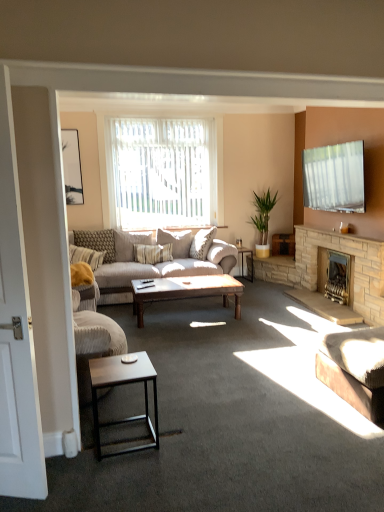
Describe the element at coordinates (97, 242) in the screenshot. I see `textured beige pillow at center, which appears as the second pillow when viewed from the right` at that location.

You are a GUI agent. You are given a task and a screenshot of the screen. Output one action in this format:
    pyautogui.click(x=<x>, y=<y>)
    Task: Click on the brown textured fabric studio couch at lower right, which is the 2th studio couch in back-to-front order
    This screenshot has height=512, width=384.
    Given the screenshot: What is the action you would take?
    pyautogui.click(x=354, y=370)

Find the location of a particular element. black wood side table at center is located at coordinates (242, 262).

Where is `green leafy plant at center-right`? Image resolution: width=384 pixels, height=512 pixels. green leafy plant at center-right is located at coordinates (263, 214).

Identify the location of picture frame lying behind the wooden coffee table at center, marked as the 1th coffee table in a back-to-front arrangement. Image resolution: width=384 pixels, height=512 pixels. (72, 167).

Based on the photo, considering the relative positions of matte black picture frame at upper left and wooden coffee table at center, acting as the 2th coffee table starting from the front, in the image provided, is matte black picture frame at upper left to the left or to the right of wooden coffee table at center, acting as the 2th coffee table starting from the front,?

Based on their positions, matte black picture frame at upper left is located to the left of wooden coffee table at center, acting as the 2th coffee table starting from the front.

Is matte black picture frame at upper left oriented away from wooden coffee table at center, marked as the 1th coffee table in a back-to-front arrangement?

matte black picture frame at upper left does not have its back to wooden coffee table at center, marked as the 1th coffee table in a back-to-front arrangement.

Measure the distance from matte black picture frame at upper left to wooden coffee table at center, marked as the 1th coffee table in a back-to-front arrangement.

They are 2.06 meters apart.

Is the surface of beige fabric couch at center, which ranks as the 2th studio couch in right-to-left order, in direct contact with brown textured fabric studio couch at lower right, which is the 2th studio couch in back-to-front order?

beige fabric couch at center, which ranks as the 2th studio couch in right-to-left order, and brown textured fabric studio couch at lower right, which is the 2th studio couch in back-to-front order, are clearly separated.

Is beige fabric couch at center, which ranks as the first studio couch in back-to-front order, situated inside brown textured fabric studio couch at lower right, marked as the first studio couch in a right-to-left arrangement, or outside?

beige fabric couch at center, which ranks as the first studio couch in back-to-front order, is not enclosed by brown textured fabric studio couch at lower right, marked as the first studio couch in a right-to-left arrangement.

Considering the sizes of beige fabric couch at center, the 2th studio couch positioned from the front, and brown textured fabric studio couch at lower right, the 2th studio couch positioned from the left, in the image, is beige fabric couch at center, the 2th studio couch positioned from the front, wider or thinner than brown textured fabric studio couch at lower right, the 2th studio couch positioned from the left,?

Clearly, beige fabric couch at center, the 2th studio couch positioned from the front, has more width compared to brown textured fabric studio couch at lower right, the 2th studio couch positioned from the left.

Does point (225, 273) come farther from viewer compared to point (363, 375)?

That is True.

Is white wood screen door at left at the back of beige fabric pillow at center, the 1th pillow in the right-to-left sequence?

beige fabric pillow at center, the 1th pillow in the right-to-left sequence, is not turned away from white wood screen door at left.

Who is taller, beige fabric pillow at center, marked as the 3th pillow in a left-to-right arrangement, or white wood screen door at left?

white wood screen door at left.

From the image's perspective, which object appears higher, beige fabric pillow at center, the 1th pillow in the right-to-left sequence, or white wood screen door at left?

beige fabric pillow at center, the 1th pillow in the right-to-left sequence.

Looking at their sizes, would you say beige fabric pillow at center, the 1th pillow in the right-to-left sequence, is wider or thinner than white wood screen door at left?

In the image, beige fabric pillow at center, the 1th pillow in the right-to-left sequence, appears to be wider than white wood screen door at left.

Could you measure the distance between stone fireplace at right, the 2th fireplace when ordered from back to front, and textured beige pillow at left, the 3th pillow in the right-to-left sequence?

stone fireplace at right, the 2th fireplace when ordered from back to front, and textured beige pillow at left, the 3th pillow in the right-to-left sequence, are 2.82 meters apart from each other.

Does point (373, 302) come farther from viewer compared to point (73, 259)?

No, it is not.

How many degrees apart are the facing directions of stone fireplace at right, the 1th fireplace from the front, and textured beige pillow at left, the first pillow from the left?

73.3 degrees.

Is stone fireplace at right, the 1th fireplace from the front, next to textured beige pillow at left, the 3th pillow in the right-to-left sequence?

stone fireplace at right, the 1th fireplace from the front, is not next to textured beige pillow at left, the 3th pillow in the right-to-left sequence, and they're not touching.

Is beige fabric pillow at center, marked as the 3th pillow in a left-to-right arrangement, touching black wood side table at center?

No, beige fabric pillow at center, marked as the 3th pillow in a left-to-right arrangement, is not in contact with black wood side table at center.

Which object is wider, beige fabric pillow at center, marked as the 3th pillow in a left-to-right arrangement, or black wood side table at center?

black wood side table at center.

Is point (123, 236) in front of point (252, 263)?

That is True.

Is beige fabric pillow at center, the 1th pillow in the right-to-left sequence, facing towards black wood side table at center?

No, beige fabric pillow at center, the 1th pillow in the right-to-left sequence, is not turned towards black wood side table at center.

Considering the sizes of objects beige fabric pillow at center, marked as the 3th pillow in a left-to-right arrangement, and brown textured fabric studio couch at lower right, the first studio couch from the front, in the image provided, who is thinner, beige fabric pillow at center, marked as the 3th pillow in a left-to-right arrangement, or brown textured fabric studio couch at lower right, the first studio couch from the front,?

With smaller width is beige fabric pillow at center, marked as the 3th pillow in a left-to-right arrangement.

In the scene shown: How many degrees apart are the facing directions of beige fabric pillow at center, marked as the 3th pillow in a left-to-right arrangement, and brown textured fabric studio couch at lower right, which is the 2th studio couch in back-to-front order?

beige fabric pillow at center, marked as the 3th pillow in a left-to-right arrangement, and brown textured fabric studio couch at lower right, which is the 2th studio couch in back-to-front order, are facing 93.7 degrees away from each other.

In the image, is beige fabric pillow at center, marked as the 3th pillow in a left-to-right arrangement, positioned in front of or behind brown textured fabric studio couch at lower right, marked as the first studio couch in a right-to-left arrangement?

beige fabric pillow at center, marked as the 3th pillow in a left-to-right arrangement, is positioned farther from the viewer than brown textured fabric studio couch at lower right, marked as the first studio couch in a right-to-left arrangement.

From the picture: Considering the relative sizes of beige fabric pillow at center, the 1th pillow in the right-to-left sequence, and brown textured fabric studio couch at lower right, the first studio couch from the front, in the image provided, is beige fabric pillow at center, the 1th pillow in the right-to-left sequence, taller than brown textured fabric studio couch at lower right, the first studio couch from the front,?

Correct, beige fabric pillow at center, the 1th pillow in the right-to-left sequence, is much taller as brown textured fabric studio couch at lower right, the first studio couch from the front.

Who is taller, wooden coffee table at center, acting as the 2th coffee table starting from the front, or matte black picture frame at upper left?

matte black picture frame at upper left.

Is wooden coffee table at center, acting as the 2th coffee table starting from the front, positioned with its back to matte black picture frame at upper left?

No, wooden coffee table at center, acting as the 2th coffee table starting from the front,'s orientation is not away from matte black picture frame at upper left.

This screenshot has height=512, width=384. There is a matte black picture frame at upper left. Find the location of `the 1st coffee table below it (from the image's perspective)`. the 1st coffee table below it (from the image's perspective) is located at coordinates (186, 291).

This screenshot has width=384, height=512. Identify the location of picture frame on the left of wooden coffee table at center, acting as the 2th coffee table starting from the front. (72, 167).

You are a GUI agent. You are given a task and a screenshot of the screen. Output one action in this format:
    pyautogui.click(x=<x>, y=<y>)
    Task: Click on the studio couch that is under the beige fabric couch at center, the 2th studio couch positioned from the front (from a real-world perspective)
    This screenshot has height=512, width=384.
    Given the screenshot: What is the action you would take?
    pyautogui.click(x=354, y=370)

From the picture: Based on their spatial positions, is textured beige pillow at left, the 3th pillow in the right-to-left sequence, or textured beige pillow at center, which appears as the second pillow when viewed from the right, further from wooden coffee table at center, acting as the 2th coffee table starting from the front?

textured beige pillow at center, which appears as the second pillow when viewed from the right, is positioned further to the anchor wooden coffee table at center, acting as the 2th coffee table starting from the front.

Estimate the real-world distances between objects in this image. Which object is further from dark brown wooden coffee table at center, the first coffee table positioned from the front, wooden coffee table at center, acting as the 2th coffee table starting from the front, or green leafy plant at center-right?

green leafy plant at center-right is positioned further to the anchor dark brown wooden coffee table at center, the first coffee table positioned from the front.

Estimate the real-world distances between objects in this image. Which object is further from black wood side table at center, textured beige pillow at center, which appears as the second pillow when viewed from the right, or dark brown wooden coffee table at center, the first coffee table positioned from the front?

Among the two, dark brown wooden coffee table at center, the first coffee table positioned from the front, is located further to black wood side table at center.

From the image, which object appears to be nearer to textured beige pillow at center, the 2th pillow viewed from the left, beige fabric couch at center, which ranks as the first studio couch in back-to-front order, or stone fireplace at right, the 1th fireplace from the front?

The object closer to textured beige pillow at center, the 2th pillow viewed from the left, is beige fabric couch at center, which ranks as the first studio couch in back-to-front order.

Considering their positions, is black wood side table at center positioned closer to green leafy plant at center-right than dark brown wooden coffee table at center, the first coffee table positioned from the front?

black wood side table at center lies closer to green leafy plant at center-right than the other object.

Looking at the image, which one is located closer to white sheer curtains at center, brass/bronze fireplace at lower right, placed as the second fireplace when sorted from front to back, or stone fireplace at right, the 1th fireplace from the front?

Among the two, stone fireplace at right, the 1th fireplace from the front, is located nearer to white sheer curtains at center.

Estimate the real-world distances between objects in this image. Which object is further from white wood screen door at left, beige fabric pillow at center, the 1th pillow in the right-to-left sequence, or brown textured fabric studio couch at lower right, the first studio couch from the front?

Among the two, beige fabric pillow at center, the 1th pillow in the right-to-left sequence, is located further to white wood screen door at left.

Considering their positions, is white sheer curtains at center positioned further to white wood screen door at left than brown textured fabric studio couch at lower right, which is the 2th studio couch in back-to-front order?

white sheer curtains at center.

Locate an element on the screen. side table between textured beige pillow at center, which appears as the second pillow when viewed from the right, and stone fireplace at right, the 1th fireplace from the front, from left to right is located at coordinates (242, 262).

Where is `studio couch between brown textured fabric studio couch at lower right, the first studio couch from the front, and black wood side table at center, along the z-axis`? studio couch between brown textured fabric studio couch at lower right, the first studio couch from the front, and black wood side table at center, along the z-axis is located at coordinates (141, 263).

Identify the location of coffee table between dark brown wooden coffee table at center, the first coffee table positioned from the front, and beige fabric pillow at center, marked as the 3th pillow in a left-to-right arrangement, from front to back. (186, 291).

Locate an element on the screen. window between brown textured fabric studio couch at lower right, the first studio couch from the front, and black wood side table at center from front to back is located at coordinates (161, 172).